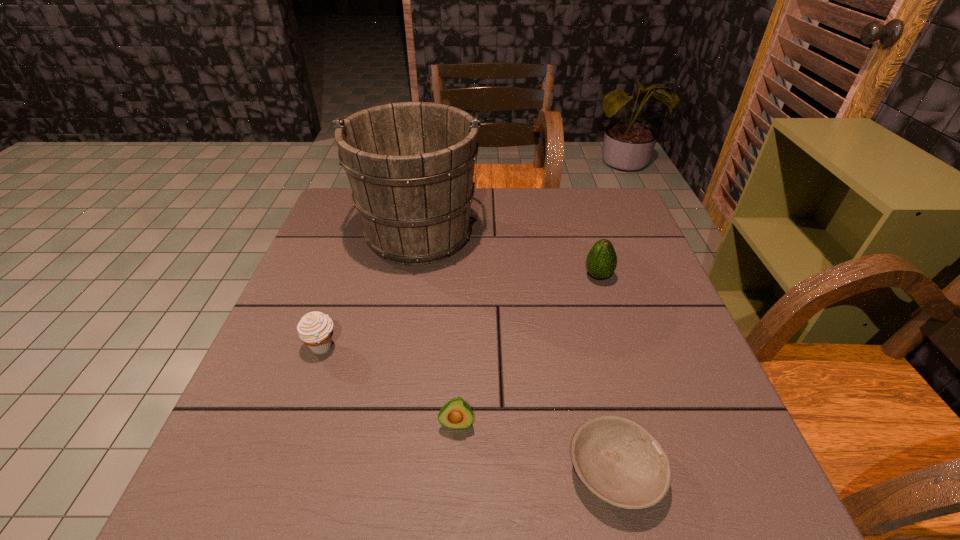
Where is `free spot located 0.370m on the left of the bowl`? Image resolution: width=960 pixels, height=540 pixels. free spot located 0.370m on the left of the bowl is located at coordinates (344, 472).

Locate an element on the screen. This screenshot has width=960, height=540. object that is positioned at the far edge is located at coordinates (410, 165).

At what (x,y) coordinates should I click in order to perform the action: click on object present at the near edge. Please return your answer as a coordinate pair (x, y). Looking at the image, I should click on (618, 460).

This screenshot has width=960, height=540. What are the coordinates of `bucket that is at the left edge` in the screenshot? It's located at (410, 165).

The image size is (960, 540). Find the location of `muffin at the left edge`. muffin at the left edge is located at coordinates (315, 329).

You are a GUI agent. You are given a task and a screenshot of the screen. Output one action in this format:
    pyautogui.click(x=<x>, y=<y>)
    Task: Click on the avocado that is at the right edge
    Image resolution: width=960 pixels, height=540 pixels.
    Given the screenshot: What is the action you would take?
    pyautogui.click(x=601, y=262)

Find the location of `bowl that is at the right edge`. bowl that is at the right edge is located at coordinates (618, 460).

I want to click on object that is positioned at the far left corner, so click(x=410, y=165).

Identify the location of object located in the near right corner section of the desktop. (618, 460).

In the image, there is a desktop. Identify the location of vacant space at the far edge. This screenshot has height=540, width=960. (574, 210).